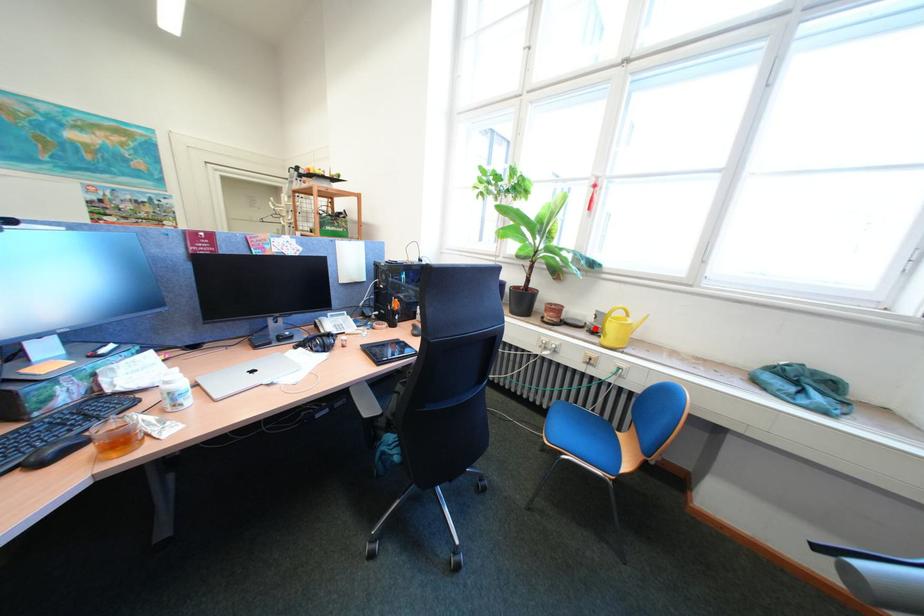
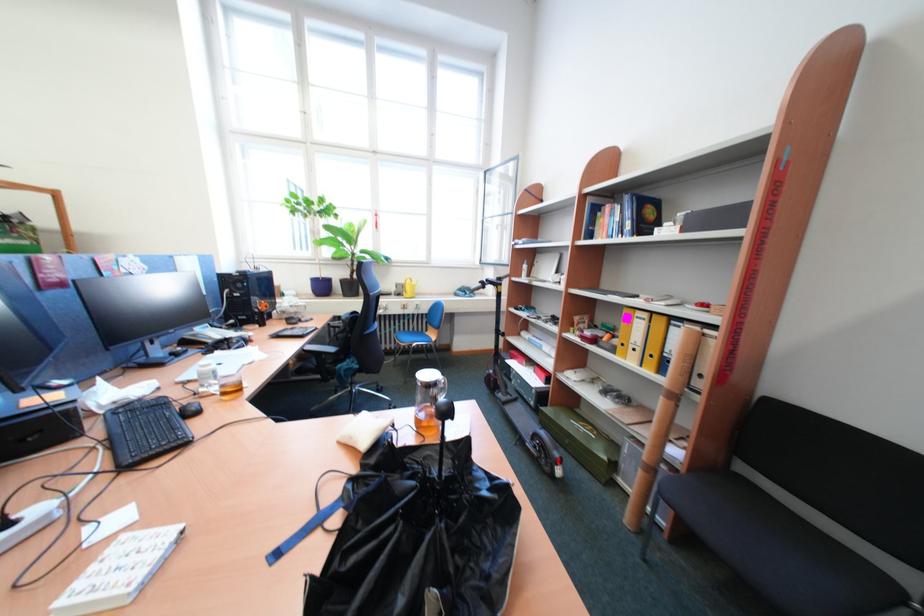
Locate, in the second image, the point that corresponds to the highlighted location in the first image.

(403, 296)